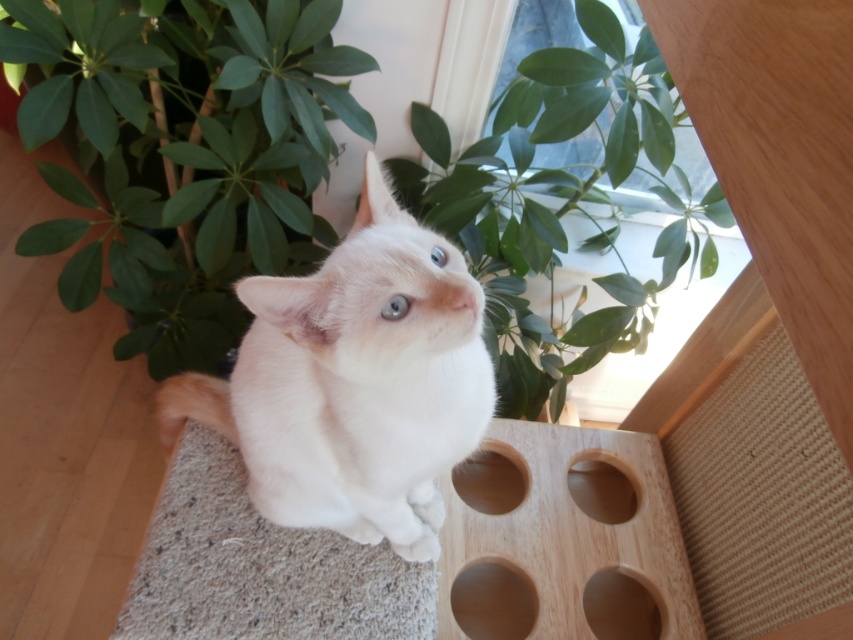
Question: Does green leafy plant at upper left appear on the right side of wooden hole at center?

Choices:
 (A) yes
 (B) no

Answer: (B)

Question: Estimate the real-world distances between objects in this image. Which object is closer to the smooth wood hole at lower right?

Choices:
 (A) green leafy plant at upper left
 (B) smooth wood hole at lower center
 (C) green leafy plant at upper center

Answer: (B)

Question: Which point is farther to the camera?

Choices:
 (A) (612, 516)
 (B) (456, 490)
 (C) (341, 522)

Answer: (A)

Question: Is green leafy plant at upper left thinner than smooth wood hole at center?

Choices:
 (A) yes
 (B) no

Answer: (B)

Question: Which object is farther from the camera taking this photo?

Choices:
 (A) smooth wood hole at lower center
 (B) smooth wood hole at lower right
 (C) wooden hole at center
 (D) green leafy plant at upper left

Answer: (C)

Question: Can you confirm if smooth wood hole at lower center is thinner than smooth wood hole at center?

Choices:
 (A) yes
 (B) no

Answer: (B)